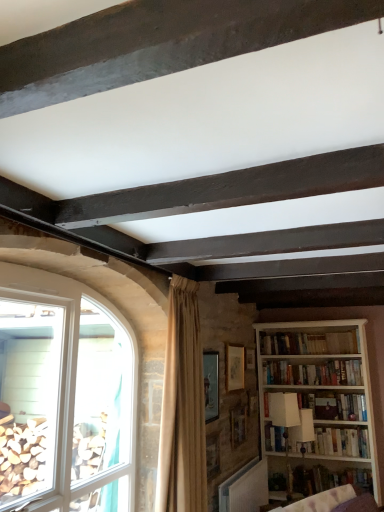
Question: Is white matte bookshelf at right, which is the 4th book from bottom to top, bigger than clear glass window at lower left?

Choices:
 (A) no
 (B) yes

Answer: (A)

Question: From the image's perspective, does white matte bookshelf at right, the 1th book when ordered from top to bottom, appear higher than clear glass window at lower left?

Choices:
 (A) yes
 (B) no

Answer: (B)

Question: Would you say white matte bookshelf at right, the 1th book when ordered from top to bottom, is outside clear glass window at lower left?

Choices:
 (A) no
 (B) yes

Answer: (B)

Question: Does white matte bookshelf at right, the 1th book when ordered from top to bottom, appear on the left side of clear glass window at lower left?

Choices:
 (A) no
 (B) yes

Answer: (A)

Question: Does white matte bookshelf at right, which is the 4th book from bottom to top, have a lesser width compared to clear glass window at lower left?

Choices:
 (A) yes
 (B) no

Answer: (A)

Question: From a real-world perspective, is white matte bookshelf at right, the 1th book when ordered from top to bottom, physically above clear glass window at lower left?

Choices:
 (A) yes
 (B) no

Answer: (A)

Question: Is the depth of white matte bookshelf at right, which is the 4th book from bottom to top, less than that of white wooden bookcase at right?

Choices:
 (A) no
 (B) yes

Answer: (A)

Question: Would you say white matte bookshelf at right, which is the 4th book from bottom to top, contains white wooden bookcase at right?

Choices:
 (A) no
 (B) yes

Answer: (A)

Question: Does white matte bookshelf at right, the 1th book when ordered from top to bottom, have a smaller size compared to white wooden bookcase at right?

Choices:
 (A) no
 (B) yes

Answer: (B)

Question: Could you tell me if white matte bookshelf at right, the 1th book when ordered from top to bottom, is facing white wooden bookcase at right?

Choices:
 (A) no
 (B) yes

Answer: (B)

Question: Is white matte bookshelf at right, the 1th book when ordered from top to bottom, at the right side of white wooden bookcase at right?

Choices:
 (A) yes
 (B) no

Answer: (B)

Question: Is white matte bookshelf at right, which is the 4th book from bottom to top, at the left side of white wooden bookcase at right?

Choices:
 (A) yes
 (B) no

Answer: (A)

Question: Can you confirm if clear glass window at lower left is shorter than wooden picture frame at center, the third picture frame in the front-to-back sequence?

Choices:
 (A) no
 (B) yes

Answer: (A)